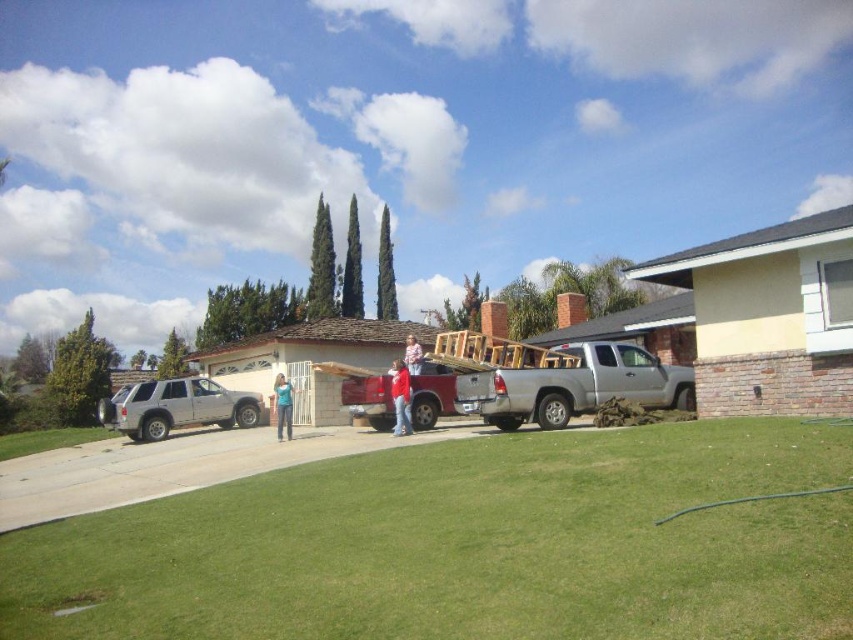
You are a fashion designer observing the scene. You notice the red matte shirt at center and the blue denim jeans at center. Which clothing item appears to be smaller in size?

The red matte shirt at center has a smaller size compared to the blue denim jeans at center.